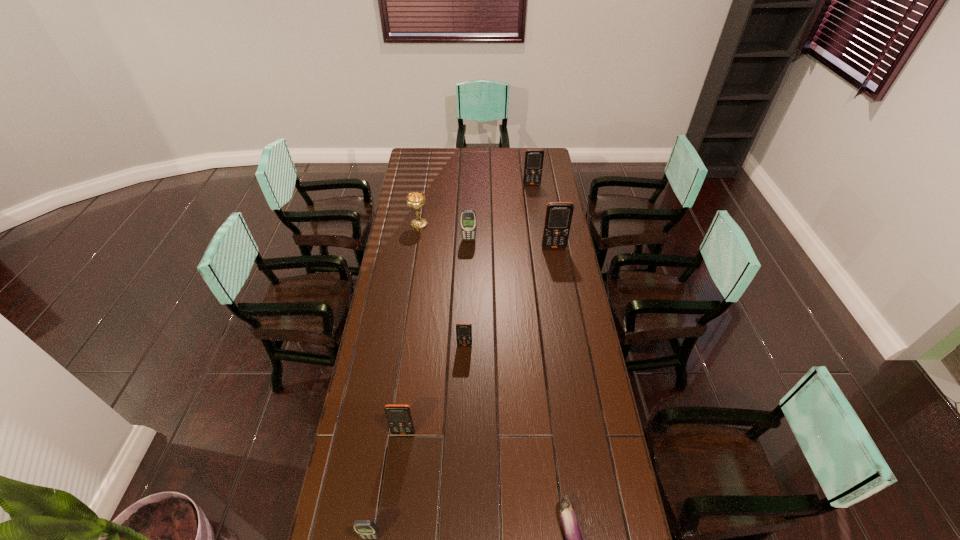
Locate an element on the screen. vacant region between the smaller gray cellular telephone and the second tallest cellular telephone is located at coordinates (451, 361).

Where is `object that can be found as the sixth closest to the third farthest orange cellular telephone`? This screenshot has height=540, width=960. object that can be found as the sixth closest to the third farthest orange cellular telephone is located at coordinates (416, 200).

Identify which object is the fifth closest to the smallest orange cellular telephone. Please provide its 2D coordinates. Your answer should be formatted as a tuple, i.e. [(x, y)], where the tuple contains the x and y coordinates of a point satisfying the conditions above.

[(366, 529)]

Identify the location of the fourth closest cellular telephone to the nearest cellular telephone. This screenshot has width=960, height=540. (558, 217).

Find the location of `cellular telephone that stands as the second closest to the bigger gray cellular telephone`. cellular telephone that stands as the second closest to the bigger gray cellular telephone is located at coordinates (533, 165).

Identify which orange cellular telephone is the nearest to the third farthest object. Please provide its 2D coordinates. Your answer should be formatted as a tuple, i.e. [(x, y)], where the tuple contains the x and y coordinates of a point satisfying the conditions above.

[(558, 217)]

Locate an element on the screen. The width and height of the screenshot is (960, 540). orange cellular telephone that can be found as the fourth closest to the eggplant is located at coordinates (533, 165).